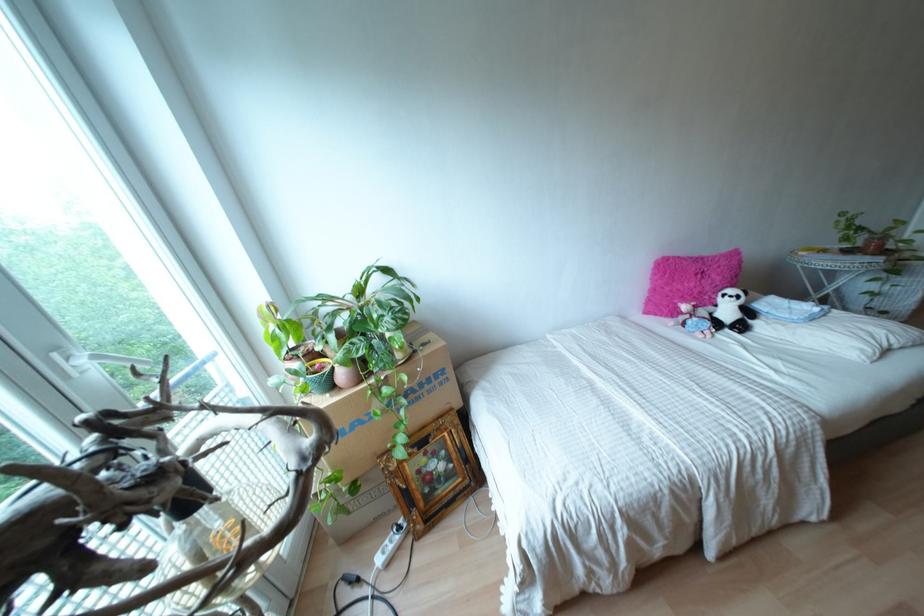
Where is `cardboard moving box`? The width and height of the screenshot is (924, 616). cardboard moving box is located at coordinates (388, 406).